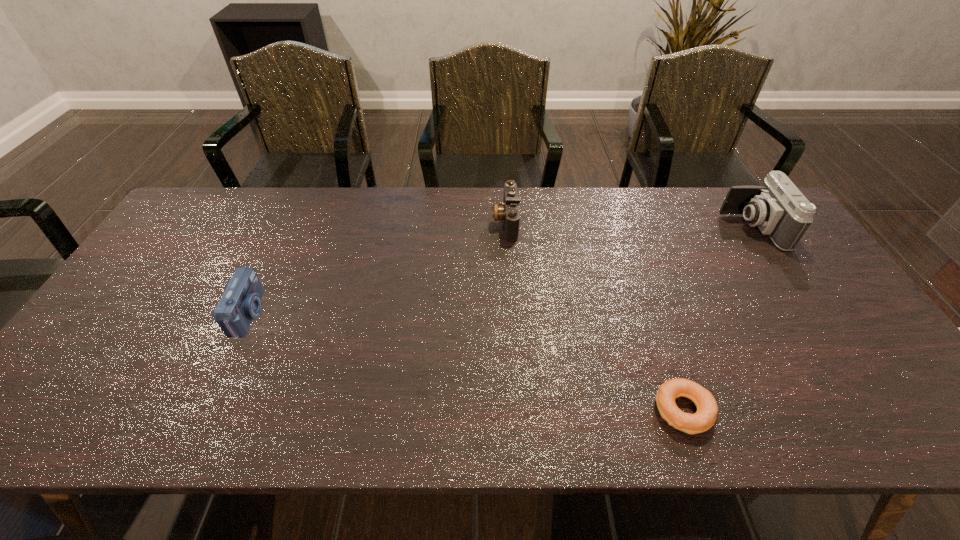
Where is `vacant space at the left edge of the desktop`? Image resolution: width=960 pixels, height=540 pixels. vacant space at the left edge of the desktop is located at coordinates (147, 353).

The image size is (960, 540). In the image, there is a desktop. Find the location of `vacant area at the right edge`. vacant area at the right edge is located at coordinates (765, 247).

Locate an element on the screen. free point at the far left corner is located at coordinates (216, 213).

The height and width of the screenshot is (540, 960). Find the location of `vacant space that is in between the tallest object and the second object from right to left`. vacant space that is in between the tallest object and the second object from right to left is located at coordinates (718, 319).

Locate an element on the screen. The image size is (960, 540). vacant space that is in between the third farthest object and the rightmost object is located at coordinates (500, 271).

Where is `free spot between the rightmost camera and the bagel`? free spot between the rightmost camera and the bagel is located at coordinates (718, 319).

Find the location of a particular element. This screenshot has width=960, height=540. free point between the second camera from right to left and the leftmost camera is located at coordinates (377, 268).

Image resolution: width=960 pixels, height=540 pixels. Identify the location of free space between the second camera from right to left and the bagel. (594, 315).

The width and height of the screenshot is (960, 540). I want to click on free area in between the third object from left to right and the rightmost object, so click(718, 319).

This screenshot has height=540, width=960. I want to click on free space between the third object from left to right and the leftmost object, so click(467, 362).